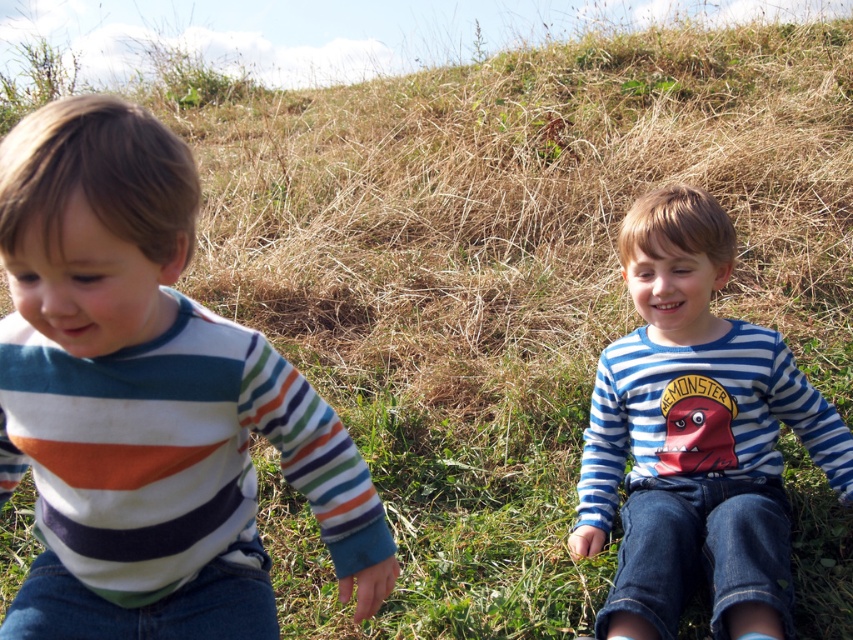
Question: Can you confirm if striped cotton shirt at left is thinner than blue striped shirt at center?

Choices:
 (A) yes
 (B) no

Answer: (A)

Question: Among these points, which one is farthest from the camera?

Choices:
 (A) [x=654, y=339]
 (B) [x=158, y=140]

Answer: (A)

Question: Is striped cotton shirt at left positioned at the back of blue striped shirt at center?

Choices:
 (A) yes
 (B) no

Answer: (B)

Question: Can you confirm if striped cotton shirt at left is positioned to the right of blue striped shirt at center?

Choices:
 (A) no
 (B) yes

Answer: (A)

Question: Which point is closer to the camera?

Choices:
 (A) (683, 509)
 (B) (154, 508)

Answer: (B)

Question: Among these points, which one is farthest from the camera?

Choices:
 (A) (621, 554)
 (B) (96, 232)

Answer: (A)